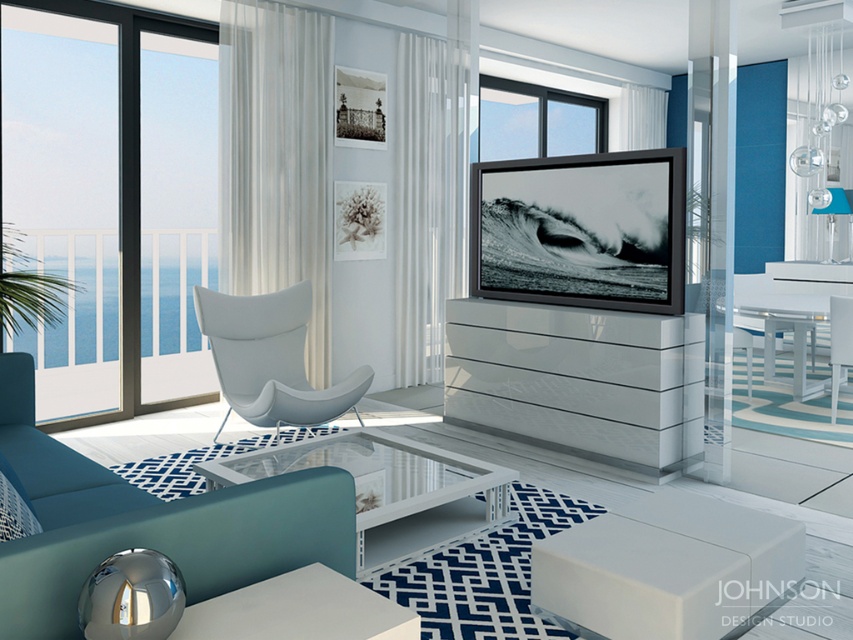
You are planning to place a large potted plant in the living room. The plant requires a space that is at least as big as the transparent glass window at left. Can the matte blue couch at lower left accommodate the plant?

The transparent glass window at left is bigger than the matte blue couch at lower left, so the matte blue couch at lower left cannot accommodate the plant as it is smaller than the required space.